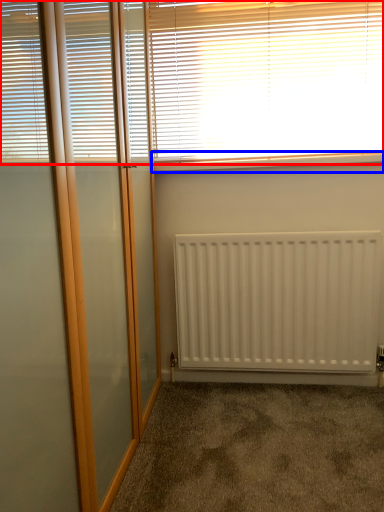
Question: Which object appears farthest to the camera in this image, window blind (highlighted by a red box) or window sill (highlighted by a blue box)?

Choices:
 (A) window blind
 (B) window sill

Answer: (B)